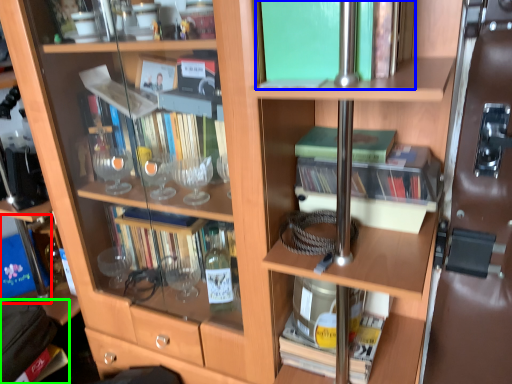
Question: Considering the real-world distances, which object is closest to box (highlighted by a red box)? book (highlighted by a blue box) or handbag (highlighted by a green box).

Choices:
 (A) book
 (B) handbag

Answer: (B)